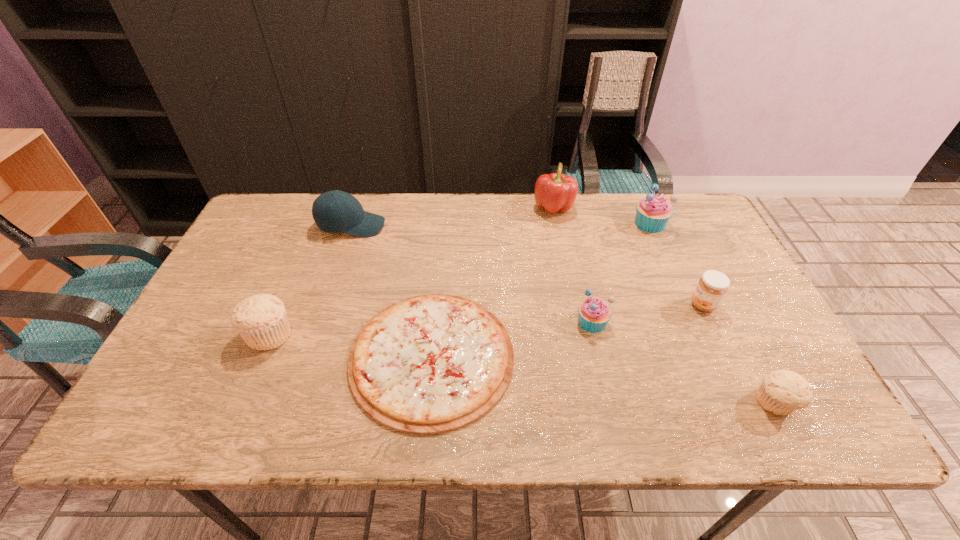
Locate an element on the screen. This screenshot has height=540, width=960. empty location between the left beige muffin and the blue baseball cap is located at coordinates (310, 280).

Locate an element on the screen. The width and height of the screenshot is (960, 540). free point between the smaller blue muffin and the second muffin from right to left is located at coordinates (621, 273).

Image resolution: width=960 pixels, height=540 pixels. I want to click on unoccupied position between the bigger blue muffin and the pink pepper, so click(602, 215).

At what (x,y) coordinates should I click in order to perform the action: click on vacant space in between the blue baseball cap and the pizza. Please return your answer as a coordinate pair (x, y). This screenshot has height=540, width=960. Looking at the image, I should click on (392, 291).

In order to click on empty space between the jam and the nearer blue muffin in this screenshot , I will do `click(648, 313)`.

You are a GUI agent. You are given a task and a screenshot of the screen. Output one action in this format:
    pyautogui.click(x=<x>, y=<y>)
    Task: Click on the object that can be found as the fourth closest to the bigger blue muffin
    The image size is (960, 540).
    Given the screenshot: What is the action you would take?
    pyautogui.click(x=429, y=364)

At what (x,y) coordinates should I click in order to perform the action: click on the sixth closest object to the pepper. Please return your answer as a coordinate pair (x, y). Looking at the image, I should click on (781, 392).

Where is `the closest muffin to the leftmost muffin`? This screenshot has width=960, height=540. the closest muffin to the leftmost muffin is located at coordinates (594, 313).

Select which muffin is the closest to the blue baseball cap. Please provide its 2D coordinates. Your answer should be formatted as a tuple, i.e. [(x, y)], where the tuple contains the x and y coordinates of a point satisfying the conditions above.

[(261, 320)]

Locate an element on the screen. The height and width of the screenshot is (540, 960). vacant position in the image that satisfies the following two spatial constraints: 1. on the front-facing side of the blue baseball cap; 2. on the left side of the pizza is located at coordinates (308, 356).